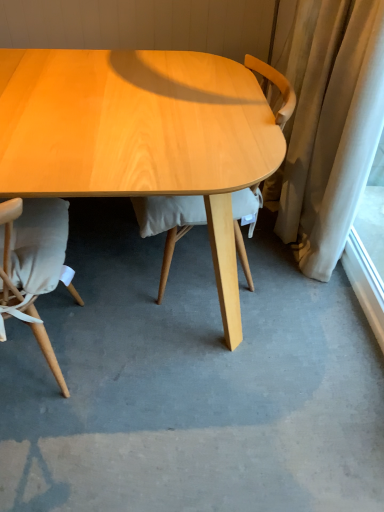
In order to click on empty space that is in between matte beige chair at lower left, the 1th chair in the left-to-right sequence, and light wood chair at center, the 1th chair positioned from the right in this screenshot , I will do `click(137, 324)`.